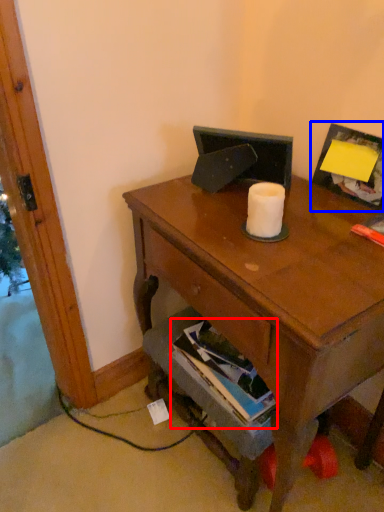
Question: Which point is closer to the camera, book (highlighted by a red box) or picture frame (highlighted by a blue box)?

Choices:
 (A) book
 (B) picture frame

Answer: (B)